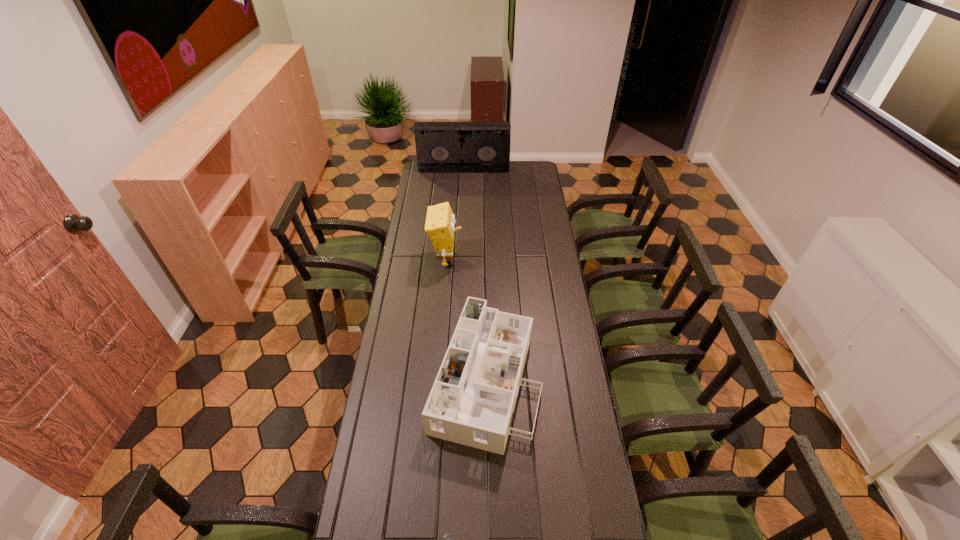
Image resolution: width=960 pixels, height=540 pixels. What are the coordinates of `the closest object to the farthest object` in the screenshot? It's located at (440, 221).

Identify the location of vacant position in the image that satisfies the following two spatial constraints: 1. on the front side of the farthest object; 2. on the face of the second farthest object. (459, 259).

This screenshot has width=960, height=540. I want to click on free spot that satisfies the following two spatial constraints: 1. on the face of the second shortest object; 2. on the left side of the sponge, so click(x=437, y=378).

Find the location of `vacant area in the image that satisfies the following two spatial constraints: 1. on the face of the second farthest object; 2. on the back side of the third farthest object`. vacant area in the image that satisfies the following two spatial constraints: 1. on the face of the second farthest object; 2. on the back side of the third farthest object is located at coordinates (437, 378).

At what (x,y) coordinates should I click in order to perform the action: click on vacant region that satisfies the following two spatial constraints: 1. on the front side of the videotape; 2. on the left side of the third farthest object. Please return your answer as a coordinate pair (x, y). The width and height of the screenshot is (960, 540). Looking at the image, I should click on (453, 378).

The height and width of the screenshot is (540, 960). Find the location of `blank space that satisfies the following two spatial constraints: 1. on the face of the third nearest object; 2. on the right side of the third farthest object`. blank space that satisfies the following two spatial constraints: 1. on the face of the third nearest object; 2. on the right side of the third farthest object is located at coordinates (437, 378).

This screenshot has height=540, width=960. What are the coordinates of `vacant area that satisfies the following two spatial constraints: 1. on the front side of the videotape; 2. on the face of the second farthest object` in the screenshot? It's located at (459, 259).

What are the coordinates of `free spot that satisfies the following two spatial constraints: 1. on the front side of the third tallest object; 2. on the right side of the farthest object` in the screenshot? It's located at (453, 378).